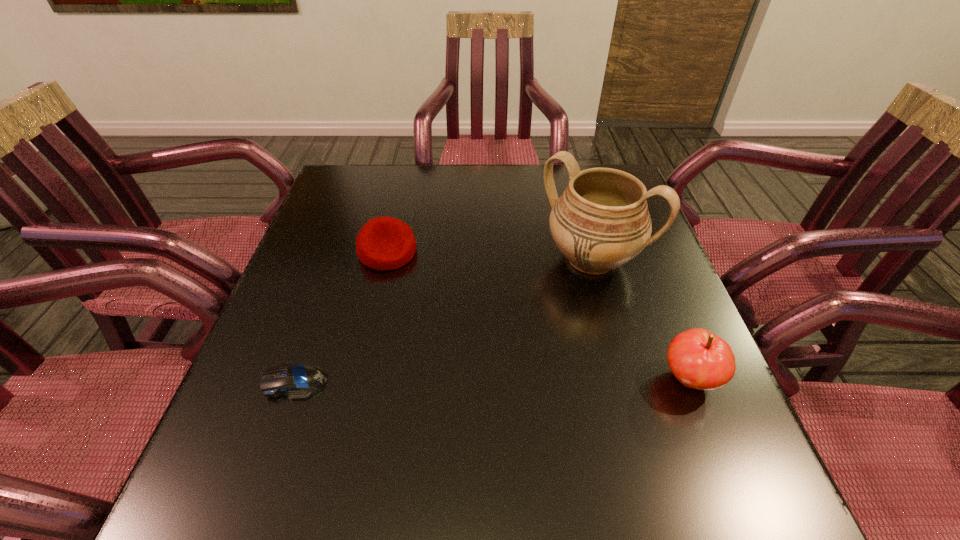
The height and width of the screenshot is (540, 960). What are the coordinates of `free space at the far left corner of the desktop` in the screenshot? It's located at (376, 181).

The height and width of the screenshot is (540, 960). In order to click on free space between the urn and the beanbag in this screenshot , I will do `click(490, 255)`.

Find the location of a particular element. This screenshot has width=960, height=540. empty location between the third tallest object and the computer mouse is located at coordinates (341, 316).

Where is `empty space between the third tallest object and the apple`? The width and height of the screenshot is (960, 540). empty space between the third tallest object and the apple is located at coordinates (539, 315).

Identify the location of empty space that is in between the beanbag and the tallest object. This screenshot has height=540, width=960. (490, 255).

Locate an element on the screen. free spot between the shortest object and the tallest object is located at coordinates (444, 320).

At what (x,y) coordinates should I click in order to perform the action: click on free spot between the third tallest object and the computer mouse. Please return your answer as a coordinate pair (x, y). The width and height of the screenshot is (960, 540). Looking at the image, I should click on (341, 316).

Where is `vacant area that lies between the apple and the urn`? vacant area that lies between the apple and the urn is located at coordinates (640, 319).

Identify the location of vacant space that's between the third shortest object and the computer mouse. This screenshot has width=960, height=540. (492, 380).

Image resolution: width=960 pixels, height=540 pixels. Identify the location of free space that is in between the tallest object and the second shortest object. (490, 255).